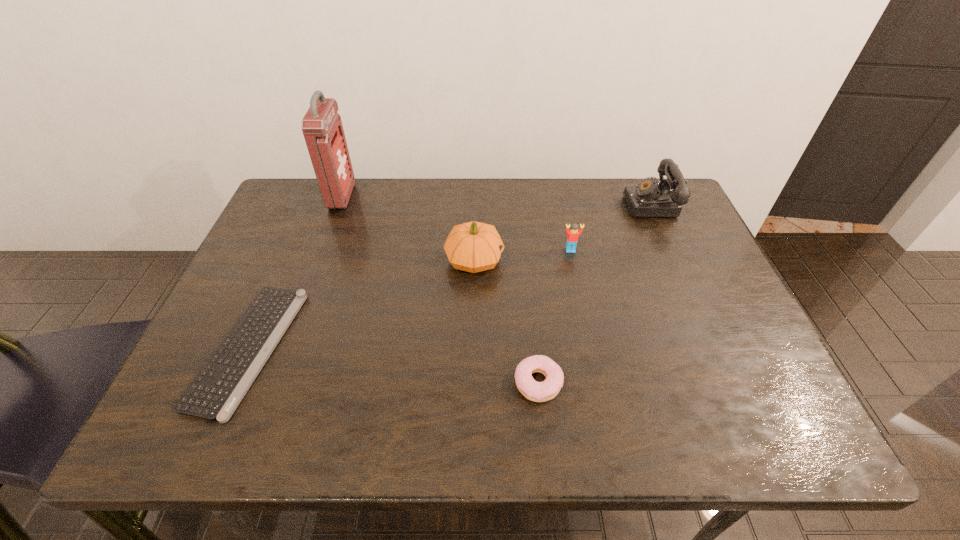
Find the location of `the tallest object`. the tallest object is located at coordinates (322, 128).

Find the location of a particular element. The image size is (960, 540). the rightmost object is located at coordinates (649, 198).

The height and width of the screenshot is (540, 960). What are the coordinates of `the fourth object from right to left` in the screenshot? It's located at (473, 246).

Where is `Lego`? Lego is located at coordinates click(x=572, y=238).

Locate an element on the screen. the third shortest object is located at coordinates (572, 238).

Where is `doughnut`? doughnut is located at coordinates (534, 391).

Find the location of a particular element. The width and height of the screenshot is (960, 540). the second shortest object is located at coordinates (534, 391).

Where is `the shortest object`? Image resolution: width=960 pixels, height=540 pixels. the shortest object is located at coordinates (217, 390).

Where is `free space located on the front-facing side of the first-aid kit`? The image size is (960, 540). free space located on the front-facing side of the first-aid kit is located at coordinates (387, 197).

You are a GUI agent. You are given a task and a screenshot of the screen. Output one action in this format:
    pyautogui.click(x=<x>, y=<y>)
    Task: Click on the vacant space located on the dial of the telephone
    Image resolution: width=960 pixels, height=540 pixels.
    Given the screenshot: What is the action you would take?
    pyautogui.click(x=569, y=204)